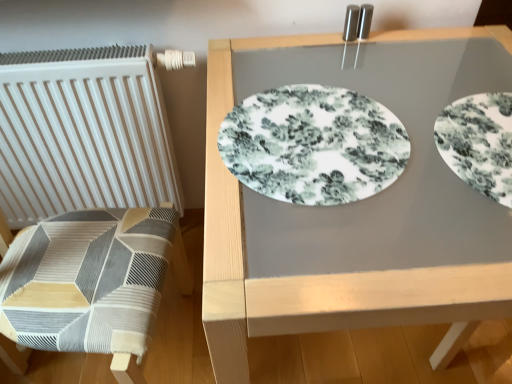
Question: From the image's perspective, is white floral plate at upper right, marked as the second plate in a left-to-right arrangement, located beneath white matte radiator at left?

Choices:
 (A) no
 (B) yes

Answer: (B)

Question: Considering the relative sizes of white floral plate at upper right, marked as the second plate in a left-to-right arrangement, and white matte radiator at left in the image provided, is white floral plate at upper right, marked as the second plate in a left-to-right arrangement, shorter than white matte radiator at left?

Choices:
 (A) no
 (B) yes

Answer: (B)

Question: Are white floral plate at upper right, marked as the second plate in a left-to-right arrangement, and white matte radiator at left located far from each other?

Choices:
 (A) yes
 (B) no

Answer: (B)

Question: From the image's perspective, is white floral plate at upper right, marked as the second plate in a left-to-right arrangement, above white matte radiator at left?

Choices:
 (A) no
 (B) yes

Answer: (A)

Question: Is white floral plate at upper right, placed as the first plate when sorted from right to left, taller than white matte radiator at left?

Choices:
 (A) no
 (B) yes

Answer: (A)

Question: Does white floral plate at upper right, placed as the first plate when sorted from right to left, turn towards white matte radiator at left?

Choices:
 (A) yes
 (B) no

Answer: (B)

Question: Does white matte radiator at left appear on the right side of white glossy placemat at center?

Choices:
 (A) yes
 (B) no

Answer: (B)

Question: Can you confirm if white matte radiator at left is positioned to the left of white glossy placemat at center?

Choices:
 (A) no
 (B) yes

Answer: (B)

Question: From the image's perspective, is white matte radiator at left beneath white glossy placemat at center?

Choices:
 (A) no
 (B) yes

Answer: (A)

Question: Can you confirm if white matte radiator at left is shorter than white glossy placemat at center?

Choices:
 (A) no
 (B) yes

Answer: (B)

Question: Can you confirm if white matte radiator at left is wider than white glossy placemat at center?

Choices:
 (A) no
 (B) yes

Answer: (A)

Question: From a real-world perspective, is white matte radiator at left positioned over white glossy placemat at center based on gravity?

Choices:
 (A) no
 (B) yes

Answer: (B)

Question: From a real-world perspective, is white matte radiator at left physically below white floral plate at upper right, marked as the second plate in a left-to-right arrangement?

Choices:
 (A) no
 (B) yes

Answer: (B)